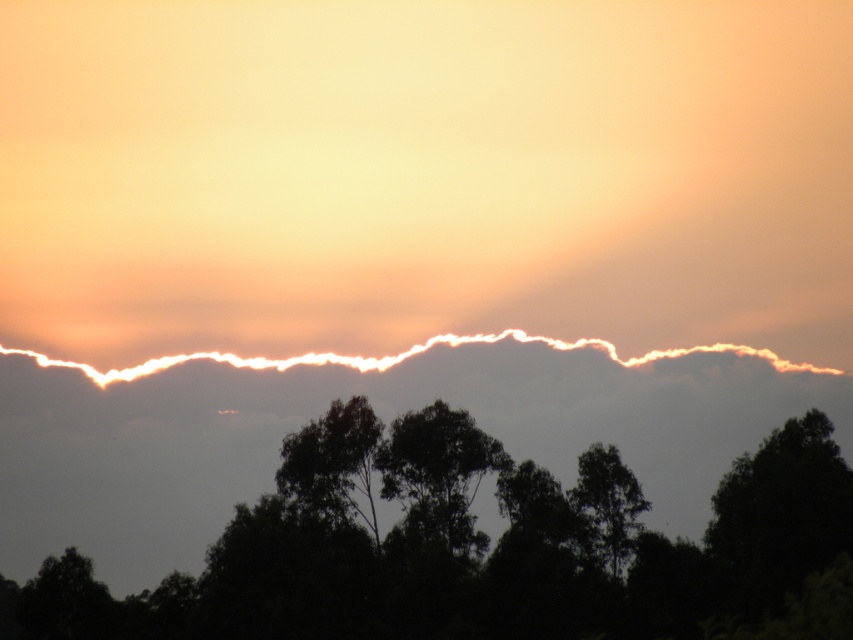
You are an artist sketching the sunset scene. You notice the white fluffy cloud at upper center and the dark green leafy tree at center. Which object is positioned to the left in the image?

The white fluffy cloud at upper center is positioned to the left of the dark green leafy tree at center.

You are standing on the ground between the silhouette leafy tree at center and the green leafy tree at center. How far apart are these two trees from each other?

The silhouette leafy tree at center is 5.27 meters from the green leafy tree at center, so the distance between them is 5.27 meters.

You are an astronomer analyzing the sunset scene. You notice two points in the image, one at coordinates point (114,561) and another at point (631,550). Based on their positions, which point is closer to the horizon line?

Point (114,561) is closer to the horizon line because it has a lower y coordinate than point (631,550). In image coordinates, lower y values are closer to the bottom of the frame, which in this scene corresponds to the horizon line.